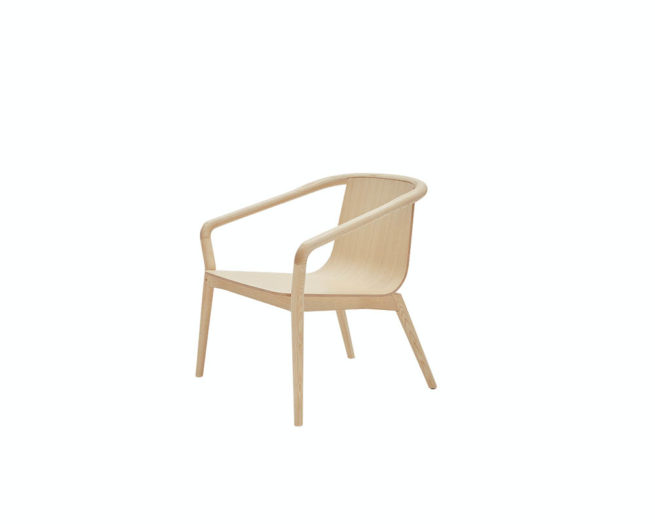
You are a GUI agent. You are given a task and a screenshot of the screen. Output one action in this format:
    pyautogui.click(x=<x>, y=<y>)
    Task: Click on the empty space below chair
    
    Given the screenshot: What is the action you would take?
    pyautogui.click(x=322, y=396)